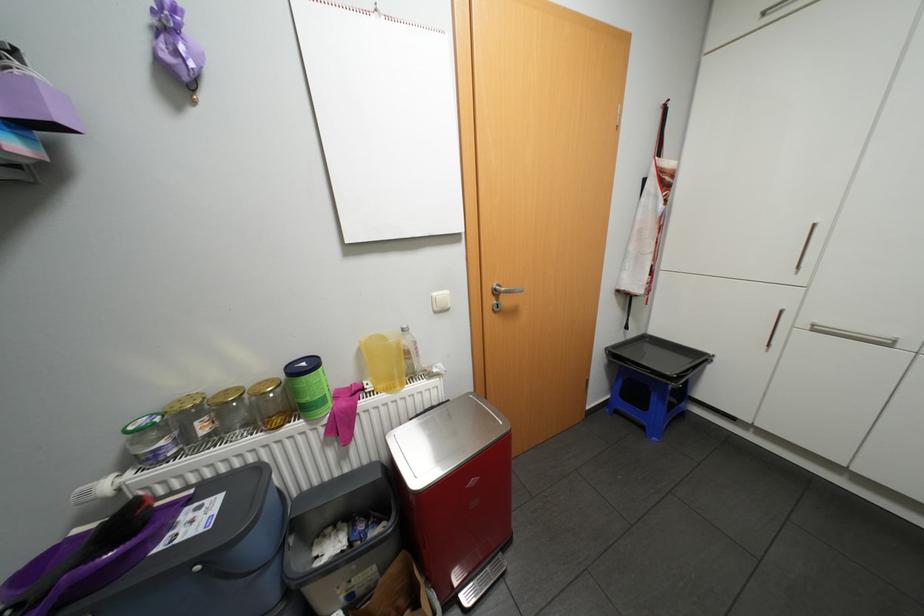
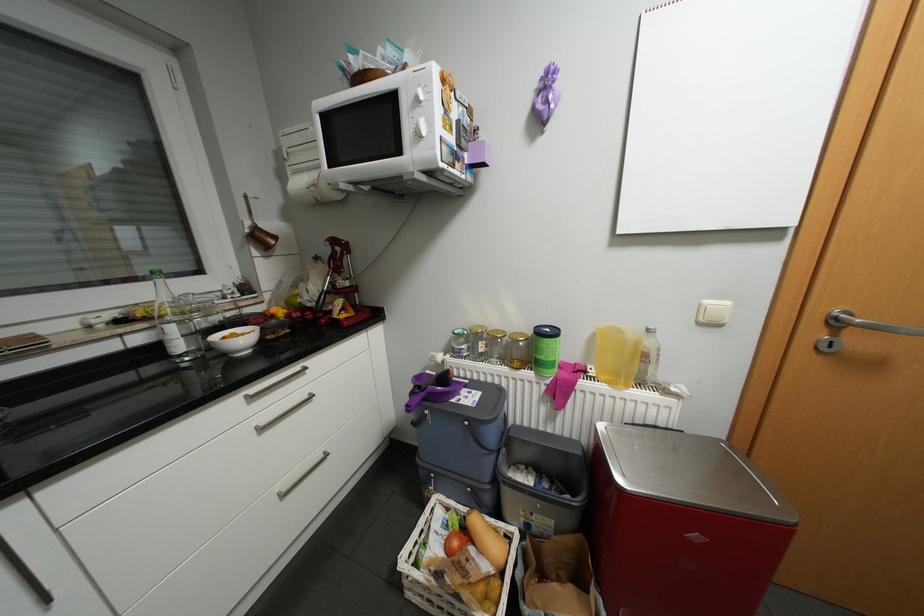
The point at (169, 442) is marked in the first image. Where is the corresponding point in the second image?

(471, 345)